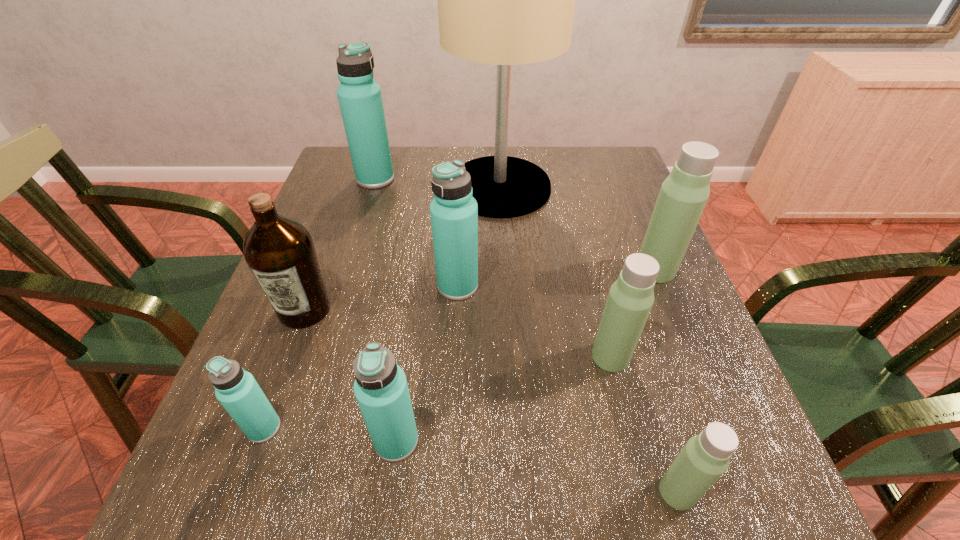
Locate which aqua thermos bottle ranks in proximity to the tallest thermos bottle. Please provide its 2D coordinates. Your answer should be formatted as a tuple, i.e. [(x, y)], where the tuple contains the x and y coordinates of a point satisfying the conditions above.

[(454, 212)]

Identify which light thermos bottle is the third closest to the brown olive oil. Please provide its 2D coordinates. Your answer should be formatted as a tuple, i.e. [(x, y)], where the tuple contains the x and y coordinates of a point satisfying the conditions above.

[(684, 193)]

Where is `light thermos bottle identified as the second closest to the smallest aqua thermos bottle`? light thermos bottle identified as the second closest to the smallest aqua thermos bottle is located at coordinates (705, 457).

At what (x,y) coordinates should I click in order to perform the action: click on free space that satisfies the following two spatial constraints: 1. on the back side of the smallest aqua thermos bottle; 2. on the left side of the rightmost light thermos bottle. Please return your answer as a coordinate pair (x, y). Looking at the image, I should click on (322, 269).

What are the coordinates of `blank space that satisfies the following two spatial constraints: 1. on the front side of the sixth farthest object; 2. on the left side of the beige table lamp` in the screenshot? It's located at (509, 356).

The width and height of the screenshot is (960, 540). I want to click on vacant point that satisfies the following two spatial constraints: 1. on the back side of the smallest aqua thermos bottle; 2. on the left side of the rightmost object, so click(x=322, y=269).